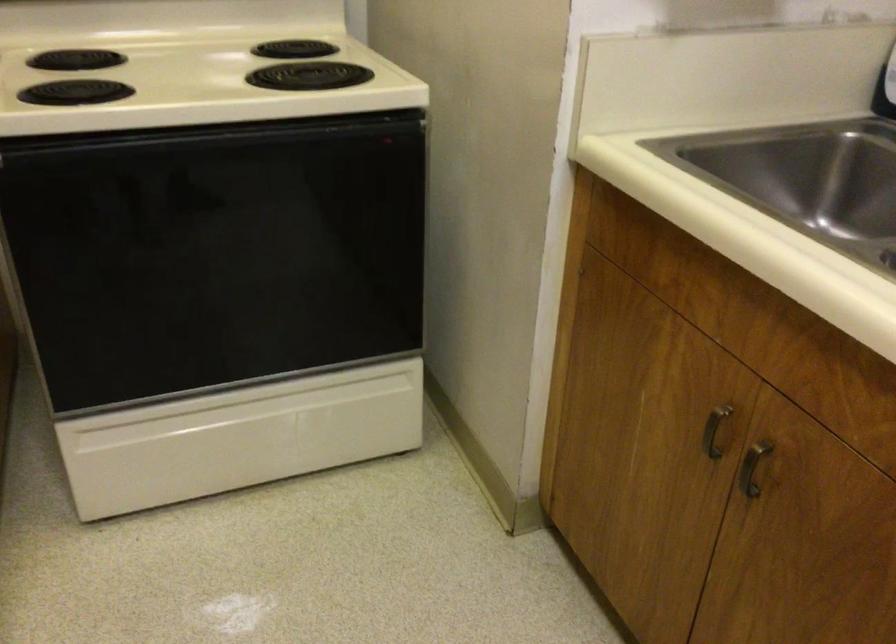
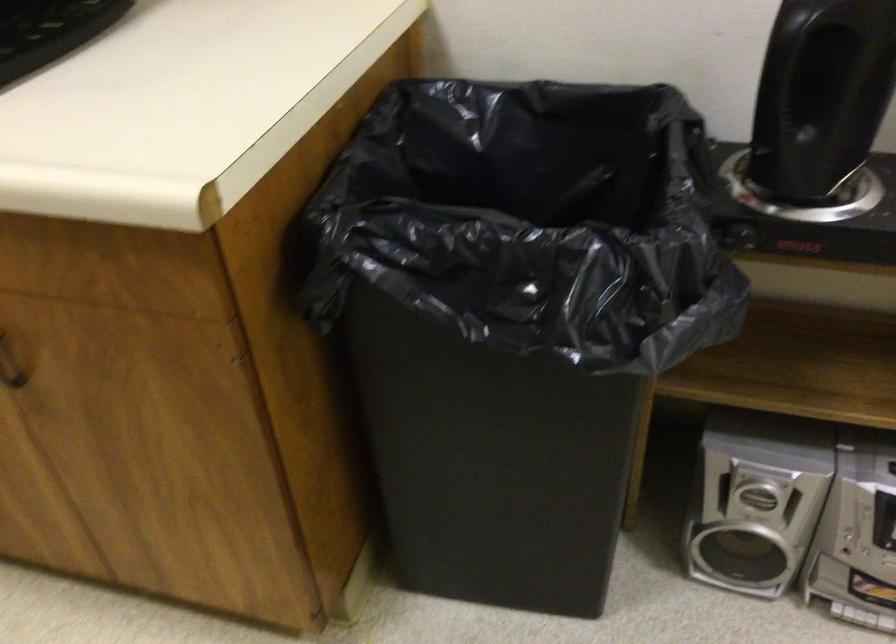
First-person continuous shooting, in which direction is the camera rotating?

The camera's rotation is toward right-down.